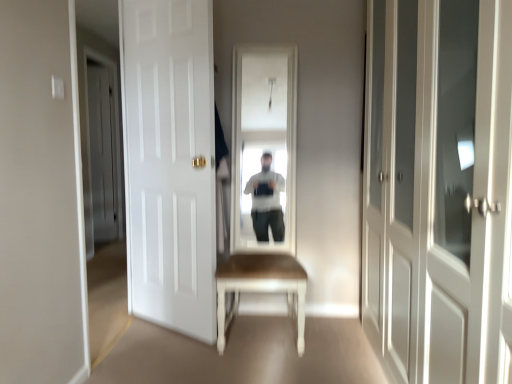
Measure the distance between point (x=155, y=22) and camera.

Point (x=155, y=22) is 8.24 feet away from camera.

Measure the distance between point (90,132) and camera.

The depth of point (90,132) is 14.83 feet.

This screenshot has width=512, height=384. What do you see at coordinates (103, 152) in the screenshot? I see `white matte door at left, acting as the 3th door starting from the right` at bounding box center [103, 152].

The height and width of the screenshot is (384, 512). Describe the element at coordinates (261, 287) in the screenshot. I see `light brown wooden table at center` at that location.

You are a GUI agent. You are given a task and a screenshot of the screen. Output one action in this format:
    pyautogui.click(x=<x>, y=<y>)
    Task: Click on the white glossy cabinet at right, the 3th door from the back
    This screenshot has width=512, height=384.
    Given the screenshot: What is the action you would take?
    pos(439,189)

In the scene shown: Measure the distance between point (x=400, y=38) and camera.

The distance of point (x=400, y=38) from camera is 1.87 meters.

Identify the location of white matte door at center, which appears as the second door when viewed from the right. This screenshot has height=384, width=512. (170, 163).

From the image's perspective, is white matte door at left, which is counted as the first door, starting from the back, located beneath light brown wooden table at center?

No, from the image's perspective, white matte door at left, which is counted as the first door, starting from the back, is not beneath light brown wooden table at center.

How much distance is there between white matte door at left, placed as the 3th door when sorted from front to back, and light brown wooden table at center?

2.68 meters.

Does white matte door at left, which is counted as the first door, starting from the back, have a greater width compared to light brown wooden table at center?

No.

Considering the sizes of objects white matte door at left, which is counted as the first door, starting from the back, and light brown wooden table at center in the image provided, who is bigger, white matte door at left, which is counted as the first door, starting from the back, or light brown wooden table at center?

With larger size is light brown wooden table at center.

The height and width of the screenshot is (384, 512). Identify the location of door above the white matte door at center, which appears as the second door when viewed from the right (from a real-world perspective). (103, 152).

Considering the sizes of white matte door at left, placed as the 3th door when sorted from front to back, and white matte door at center, which is counted as the 2th door, starting from the left, in the image, is white matte door at left, placed as the 3th door when sorted from front to back, bigger or smaller than white matte door at center, which is counted as the 2th door, starting from the left,?

white matte door at left, placed as the 3th door when sorted from front to back, is smaller than white matte door at center, which is counted as the 2th door, starting from the left.

Would you say white matte door at center, which is counted as the 2th door, starting from the back, is part of white matte door at left, which appears as the first door when viewed from the left,'s contents?

No, white matte door at left, which appears as the first door when viewed from the left, does not contain white matte door at center, which is counted as the 2th door, starting from the back.

Which object is more forward, white matte door at left, placed as the 3th door when sorted from front to back, or white matte door at center, the second door viewed from the front?

white matte door at center, the second door viewed from the front, is closer to the camera.

The image size is (512, 384). I want to click on door that is on the left side of white matte door at center, which appears as the second door when viewed from the right, so click(x=103, y=152).

Is white matte door at center, which is counted as the 2th door, starting from the left, completely or partially outside of white matte door at left, acting as the 3th door starting from the right?

That's correct, white matte door at center, which is counted as the 2th door, starting from the left, is outside of white matte door at left, acting as the 3th door starting from the right.

Could you tell me if white matte door at center, which appears as the second door when viewed from the right, is facing white matte door at left, which is counted as the first door, starting from the back?

No, white matte door at center, which appears as the second door when viewed from the right, is not turned towards white matte door at left, which is counted as the first door, starting from the back.

From the image's perspective, is white matte door at left, which appears as the first door when viewed from the left, located beneath white glossy cabinet at right, placed as the first door when sorted from right to left?

Incorrect, from the image's perspective, white matte door at left, which appears as the first door when viewed from the left, is higher than white glossy cabinet at right, placed as the first door when sorted from right to left.

Is white glossy cabinet at right, which is the 3th door from left to right, completely or partially inside white matte door at left, which appears as the first door when viewed from the left?

Actually, white glossy cabinet at right, which is the 3th door from left to right, is outside white matte door at left, which appears as the first door when viewed from the left.

Which of these two, white matte door at left, which is counted as the first door, starting from the back, or white glossy cabinet at right, the 3th door from the back, is thinner?

Thinner between the two is white matte door at left, which is counted as the first door, starting from the back.

From the image's perspective, is white glossy cabinet at right, acting as the 1th door starting from the front, on top of light brown wooden table at center?

Yes, from the image's perspective, white glossy cabinet at right, acting as the 1th door starting from the front, is above light brown wooden table at center.

From a real-world perspective, who is located higher, white glossy cabinet at right, which is the 3th door from left to right, or light brown wooden table at center?

white glossy cabinet at right, which is the 3th door from left to right, is physically above.

Who is taller, white glossy cabinet at right, the 3th door from the back, or light brown wooden table at center?

Standing taller between the two is white glossy cabinet at right, the 3th door from the back.

Based on the photo, choose the correct answer: Is white glossy cabinet at right, acting as the 1th door starting from the front, inside light brown wooden table at center or outside it?

white glossy cabinet at right, acting as the 1th door starting from the front, cannot be found inside light brown wooden table at center.

Could you tell me if white matte door at center, which is counted as the 2th door, starting from the left, is turned towards white glossy cabinet at right, placed as the first door when sorted from right to left?

No, white matte door at center, which is counted as the 2th door, starting from the left, is not aimed at white glossy cabinet at right, placed as the first door when sorted from right to left.

Is white matte door at center, which appears as the second door when viewed from the right, next to white glossy cabinet at right, which is the 3th door from left to right?

There is a gap between white matte door at center, which appears as the second door when viewed from the right, and white glossy cabinet at right, which is the 3th door from left to right.

Is point (128, 122) positioned in front of point (391, 165)?

No, (128, 122) is further to viewer.

Who is shorter, white matte door at center, the second door viewed from the front, or white glossy cabinet at right, placed as the first door when sorted from right to left?

white glossy cabinet at right, placed as the first door when sorted from right to left.

Considering the relative positions of light brown wooden table at center and white glossy cabinet at right, acting as the 1th door starting from the front, in the image provided, is light brown wooden table at center to the right of white glossy cabinet at right, acting as the 1th door starting from the front, from the viewer's perspective?

No, light brown wooden table at center is not to the right of white glossy cabinet at right, acting as the 1th door starting from the front.

Who is more distant, light brown wooden table at center or white glossy cabinet at right, which is the 3th door from left to right?

Positioned behind is light brown wooden table at center.

From the image's perspective, is light brown wooden table at center under white glossy cabinet at right, placed as the first door when sorted from right to left?

Yes, from the image's perspective, light brown wooden table at center is beneath white glossy cabinet at right, placed as the first door when sorted from right to left.

Is light brown wooden table at center spatially inside white glossy cabinet at right, acting as the 1th door starting from the front, or outside of it?

light brown wooden table at center exists outside the volume of white glossy cabinet at right, acting as the 1th door starting from the front.

The height and width of the screenshot is (384, 512). What are the coordinates of `table located in front of the white matte door at left, placed as the 3th door when sorted from front to back` in the screenshot? It's located at (261, 287).

Where is `door that is the 1st object to the right of the white matte door at left, placed as the 3th door when sorted from front to back, starting at the anchor`? door that is the 1st object to the right of the white matte door at left, placed as the 3th door when sorted from front to back, starting at the anchor is located at coordinates (170, 163).

Which object lies further to the anchor point white matte door at left, which appears as the first door when viewed from the left, white glossy cabinet at right, acting as the 1th door starting from the front, or light brown wooden table at center?

The object further to white matte door at left, which appears as the first door when viewed from the left, is white glossy cabinet at right, acting as the 1th door starting from the front.

From the image, which object appears to be farther from white matte door at left, acting as the 3th door starting from the right, white glossy cabinet at right, acting as the 1th door starting from the front, or white matte door at center, which is counted as the 2th door, starting from the left?

Based on the image, white glossy cabinet at right, acting as the 1th door starting from the front, appears to be further to white matte door at left, acting as the 3th door starting from the right.

Which object lies further to the anchor point white glossy cabinet at right, acting as the 1th door starting from the front, white matte door at center, which is counted as the 2th door, starting from the back, or light brown wooden table at center?

white matte door at center, which is counted as the 2th door, starting from the back, lies further to white glossy cabinet at right, acting as the 1th door starting from the front, than the other object.

Considering their positions, is white matte door at left, which appears as the first door when viewed from the left, positioned further to white glossy cabinet at right, acting as the 1th door starting from the front, than white matte door at center, which appears as the second door when viewed from the right?

white matte door at left, which appears as the first door when viewed from the left, is positioned further to the anchor white glossy cabinet at right, acting as the 1th door starting from the front.

From the image, which object appears to be nearer to light brown wooden table at center, white matte door at left, which is counted as the first door, starting from the back, or white matte door at center, the second door viewed from the front?

Among the two, white matte door at center, the second door viewed from the front, is located nearer to light brown wooden table at center.

Looking at the image, which one is located further to light brown wooden table at center, white glossy cabinet at right, acting as the 1th door starting from the front, or white matte door at center, which appears as the second door when viewed from the right?

Among the two, white glossy cabinet at right, acting as the 1th door starting from the front, is located further to light brown wooden table at center.

Which object lies nearer to the anchor point white matte door at center, the second door viewed from the front, white glossy cabinet at right, placed as the first door when sorted from right to left, or light brown wooden table at center?

Based on the image, light brown wooden table at center appears to be nearer to white matte door at center, the second door viewed from the front.

From the image, which object appears to be farther from white matte door at center, the second door viewed from the front, white glossy cabinet at right, which is the 3th door from left to right, or white matte door at left, which is counted as the first door, starting from the back?

white matte door at left, which is counted as the first door, starting from the back, is further to white matte door at center, the second door viewed from the front.

I want to click on door between white glossy cabinet at right, acting as the 1th door starting from the front, and light brown wooden table at center in the front-back direction, so click(x=170, y=163).

At what (x,y) coordinates should I click in order to perform the action: click on door between white glossy cabinet at right, acting as the 1th door starting from the front, and white matte door at left, which is counted as the first door, starting from the back, from front to back. Please return your answer as a coordinate pair (x, y). This screenshot has width=512, height=384. Looking at the image, I should click on (170, 163).

I want to click on table between white glossy cabinet at right, placed as the first door when sorted from right to left, and white matte door at left, placed as the 3th door when sorted from front to back, along the z-axis, so click(261, 287).

At what (x,y) coordinates should I click in order to perform the action: click on table located between white matte door at center, which is counted as the 2th door, starting from the left, and white matte door at left, which is counted as the first door, starting from the back, in the depth direction. Please return your answer as a coordinate pair (x, y). The image size is (512, 384). Looking at the image, I should click on (261, 287).